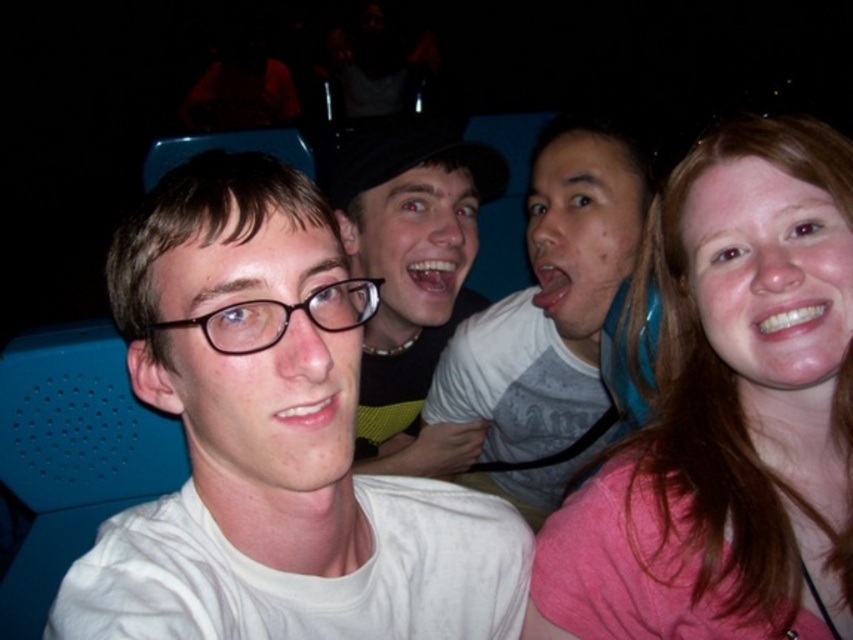
Between white matte t-shirt at center and pink fabric shirt at right, which one has less height?

white matte t-shirt at center

Does point (200, 508) come farther from viewer compared to point (764, 612)?

No, it is not.

Find the location of a particular element. The height and width of the screenshot is (640, 853). white matte t-shirt at center is located at coordinates (273, 442).

Who is shorter, pink fabric shirt at right or matte black hat at center?

pink fabric shirt at right

Does pink fabric shirt at right appear on the left side of matte black hat at center?

No, pink fabric shirt at right is not to the left of matte black hat at center.

What do you see at coordinates (728, 412) in the screenshot? I see `pink fabric shirt at right` at bounding box center [728, 412].

Identify the location of pink fabric shirt at right. (728, 412).

Does white matte t-shirt at center lie behind gray matte shirt at center?

That is False.

Who is higher up, white matte t-shirt at center or gray matte shirt at center?

gray matte shirt at center is above.

Where is `white matte t-shirt at center`? Image resolution: width=853 pixels, height=640 pixels. white matte t-shirt at center is located at coordinates (273, 442).

This screenshot has height=640, width=853. In order to click on white matte t-shirt at center in this screenshot , I will do `click(273, 442)`.